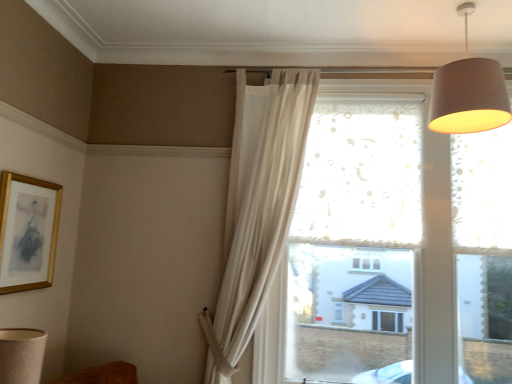
Question: Do you think gold wooden picture frame at upper left is within beige fabric lampshade at lower left, or outside of it?

Choices:
 (A) inside
 (B) outside

Answer: (B)

Question: From the image's perspective, is gold wooden picture frame at upper left located above or below beige fabric lampshade at lower left?

Choices:
 (A) below
 (B) above

Answer: (B)

Question: Which of these objects is positioned farthest from the matte gray lampshade at upper right?

Choices:
 (A) gold wooden picture frame at upper left
 (B) white sheer curtain at upper center
 (C) beige fabric lampshade at lower left
 (D) frosted glass window at center

Answer: (A)

Question: Considering the real-world distances, which object is closest to the matte gray lampshade at upper right?

Choices:
 (A) frosted glass window at center
 (B) white sheer curtain at upper center
 (C) beige fabric lampshade at lower left
 (D) gold wooden picture frame at upper left

Answer: (B)